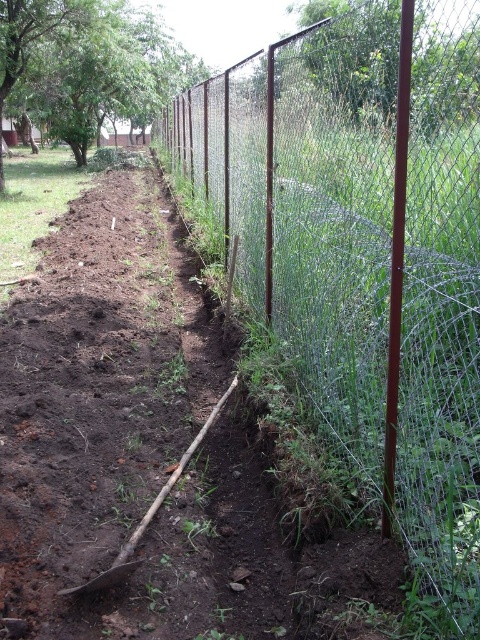
Which is behind, point (466, 417) or point (240, 547)?

Point (240, 547)

In the scene shown: Between wire mesh fence at center and brown soil at center, which one is positioned lower?

brown soil at center is lower down.

The width and height of the screenshot is (480, 640). Identify the location of wire mesh fence at center. (364, 248).

I want to click on wire mesh fence at center, so click(x=364, y=248).